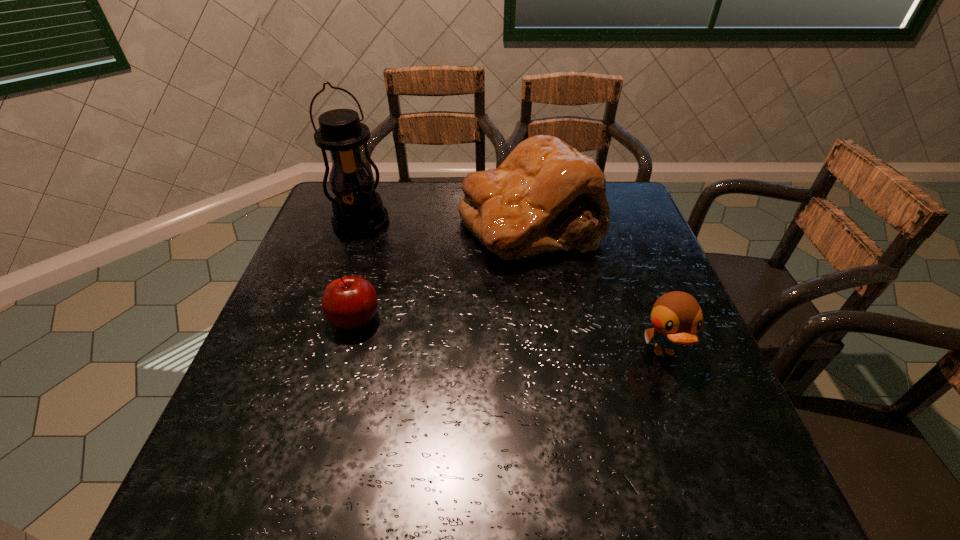
Identify the location of free space on the desktop that is between the apple and the duck and is positioned above the lantern, indicating its light source. (459, 330).

Where is `vacant space on the desktop that is between the apple and the duck and is positioned on the filling side of the bread`? vacant space on the desktop that is between the apple and the duck and is positioned on the filling side of the bread is located at coordinates (496, 334).